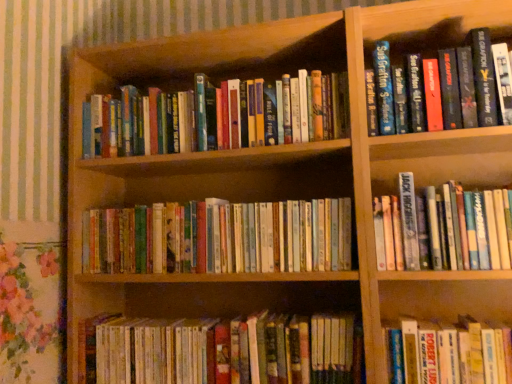
Question: Is point (x=510, y=39) positioned closer to the camera than point (x=293, y=140)?

Choices:
 (A) farther
 (B) closer

Answer: (B)

Question: Considering their positions, is hardcover book at upper right, positioned as the sixth book in bottom-to-top order, located in front of or behind hardcover books at center, the second book from the top?

Choices:
 (A) behind
 (B) front

Answer: (B)

Question: Considering the real-world distances, which object is farthest from the hardcover book at upper right, positioned as the sixth book in bottom-to-top order?

Choices:
 (A) hardcover books at center, placed as the fourth book when sorted from top to bottom
 (B) hardcover books at lower center, which ranks as the 6th book in top-to-bottom order
 (C) hardcover book at lower right, the 2th book in the bottom-to-top sequence
 (D) hardcover books at center, the second book from the top
 (E) white paperback book at right, the 4th book positioned from the bottom

Answer: (B)

Question: Considering the real-world distances, which object is farthest from the hardcover books at lower center, which is counted as the 1th book, starting from the bottom?

Choices:
 (A) hardcover books at center, the second book from the top
 (B) hardcover book at upper right, the 1th book when ordered from top to bottom
 (C) hardcover book at lower right, the 2th book in the bottom-to-top sequence
 (D) hardcover books at center, the third book positioned from the bottom
 (E) white paperback book at right, the 4th book positioned from the bottom

Answer: (B)